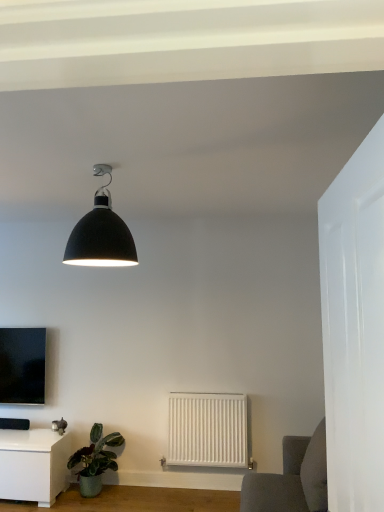
In order to face matte black lampshade at upper center, should I rotate leftwards or rightwards?

You should rotate left by 12.413 degrees.

The width and height of the screenshot is (384, 512). What do you see at coordinates (207, 430) in the screenshot?
I see `white matte radiator at center` at bounding box center [207, 430].

Describe the element at coordinates (95, 460) in the screenshot. I see `green matte plant at lower left` at that location.

This screenshot has width=384, height=512. Find the location of `matte black lampshade at upper center`. matte black lampshade at upper center is located at coordinates (101, 233).

This screenshot has height=512, width=384. What are the coordinates of `houseplant on the right side of matte black tv at left` in the screenshot? It's located at (95, 460).

Considering the positions of objects matte black tv at left and green matte plant at lower left in the image provided, who is more to the left, matte black tv at left or green matte plant at lower left?

Positioned to the left is matte black tv at left.

Is matte black tv at left positioned beyond the bounds of green matte plant at lower left?

Yes.

Is point (1, 379) less distant than point (54, 486)?

No, (1, 379) is behind (54, 486).

Is matte black tv at left oriented away from white glossy table at lower left?

No, matte black tv at left is not facing away from white glossy table at lower left.

Considering the sizes of matte black tv at left and white glossy table at lower left in the image, is matte black tv at left wider or thinner than white glossy table at lower left?

In the image, matte black tv at left appears to be more narrow than white glossy table at lower left.

Where is `table below the matte black tv at left (from the image's perspective)`? The height and width of the screenshot is (512, 384). table below the matte black tv at left (from the image's perspective) is located at coordinates (33, 465).

From the image's perspective, who appears lower, green matte plant at lower left or white matte radiator at center?

green matte plant at lower left.

Considering the relative positions of green matte plant at lower left and white matte radiator at center in the image provided, is green matte plant at lower left in front of white matte radiator at center?

Yes.

You are a GUI agent. You are given a task and a screenshot of the screen. Output one action in this format:
    pyautogui.click(x=<x>, y=<y>)
    Task: Click on the houseplant in front of the white matte radiator at center
    This screenshot has width=384, height=512.
    Given the screenshot: What is the action you would take?
    pyautogui.click(x=95, y=460)

Is point (103, 467) farther from camera compared to point (240, 445)?

That is False.

In the scene shown: Could you tell me if white glossy table at lower left is turned towards matte black lampshade at upper center?

No, white glossy table at lower left does not turn towards matte black lampshade at upper center.

Considering the relative positions of white glossy table at lower left and matte black lampshade at upper center in the image provided, is white glossy table at lower left to the left of matte black lampshade at upper center from the viewer's perspective?

Yes.

Measure the distance between white glossy table at lower left and matte black lampshade at upper center.

The distance of white glossy table at lower left from matte black lampshade at upper center is 2.23 meters.

Does white glossy table at lower left have a smaller size compared to matte black lampshade at upper center?

No, white glossy table at lower left is not smaller than matte black lampshade at upper center.

Is matte black lampshade at upper center positioned behind green matte plant at lower left?

No, it is in front of green matte plant at lower left.

From the image's perspective, would you say matte black lampshade at upper center is positioned over green matte plant at lower left?

Yes, from the image's perspective, matte black lampshade at upper center is over green matte plant at lower left.

Is matte black lampshade at upper center inside or outside of green matte plant at lower left?

The correct answer is: outside.

Is matte black lampshade at upper center aimed at green matte plant at lower left?

No, matte black lampshade at upper center is not turned towards green matte plant at lower left.

Looking at this image, could you tell me if white glossy table at lower left is turned towards white glossy door at right?

No, white glossy table at lower left is not aimed at white glossy door at right.

Are white glossy table at lower left and white glossy door at right beside each other?

There is a gap between white glossy table at lower left and white glossy door at right.

Between white glossy table at lower left and white glossy door at right, which one has smaller width?

white glossy door at right.

From a real-world perspective, is white glossy door at right located higher than white matte radiator at center?

Yes, from a real-world perspective, white glossy door at right is on top of white matte radiator at center.

Between white glossy door at right and white matte radiator at center, which one has larger size?

white glossy door at right.

From the image's perspective, between white glossy door at right and white matte radiator at center, which one is located above?

From the image's view, white glossy door at right is above.

Does point (331, 464) come in front of point (194, 439)?

That is True.

I want to click on houseplant in front of the matte black tv at left, so click(95, 460).

Where is `television above the white glossy table at lower left (from the image's perspective)`? This screenshot has height=512, width=384. television above the white glossy table at lower left (from the image's perspective) is located at coordinates (22, 365).

Consider the image. Estimate the real-world distances between objects in this image. Which object is further from matte black tv at left, white glossy door at right or matte black lampshade at upper center?

white glossy door at right is further to matte black tv at left.

From the image, which object appears to be nearer to white glossy table at lower left, white matte radiator at center or white glossy door at right?

Based on the image, white matte radiator at center appears to be nearer to white glossy table at lower left.

Which object lies further to the anchor point matte black tv at left, matte black lampshade at upper center or white matte radiator at center?

matte black lampshade at upper center.

Which object lies further to the anchor point white glossy door at right, green matte plant at lower left or matte black tv at left?

matte black tv at left is further to white glossy door at right.

Looking at the image, which one is located further to white glossy table at lower left, green matte plant at lower left or matte black lampshade at upper center?

matte black lampshade at upper center.

Based on their spatial positions, is green matte plant at lower left or matte black lampshade at upper center closer to matte black tv at left?

green matte plant at lower left.

Based on their spatial positions, is white glossy door at right or white glossy table at lower left closer to green matte plant at lower left?

Based on the image, white glossy table at lower left appears to be nearer to green matte plant at lower left.

Considering their positions, is white glossy door at right positioned further to green matte plant at lower left than white matte radiator at center?

Among the two, white glossy door at right is located further to green matte plant at lower left.

You are a GUI agent. You are given a task and a screenshot of the screen. Output one action in this format:
    pyautogui.click(x=<x>, y=<y>)
    Task: Click on the table between white glossy door at right and matte black tv at left along the z-axis
    The width and height of the screenshot is (384, 512).
    Given the screenshot: What is the action you would take?
    pyautogui.click(x=33, y=465)

Locate an element on the screen. houseplant located between matte black tv at left and white matte radiator at center in the left-right direction is located at coordinates (95, 460).

The height and width of the screenshot is (512, 384). In order to click on table between white glossy door at right and white matte radiator at center along the z-axis in this screenshot , I will do `click(33, 465)`.

Where is `lamp between white glossy door at right and green matte plant at lower left along the z-axis`? The image size is (384, 512). lamp between white glossy door at right and green matte plant at lower left along the z-axis is located at coordinates (101, 233).